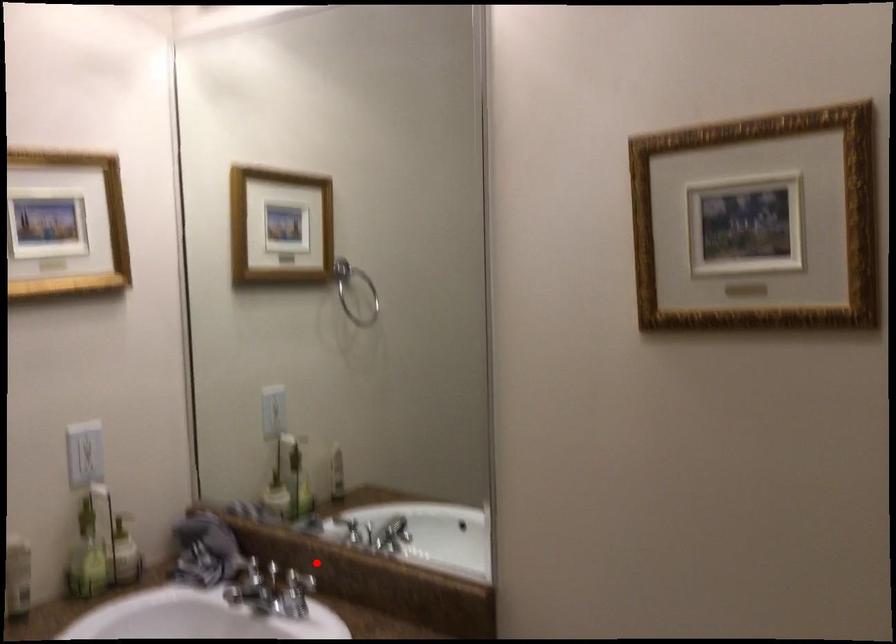
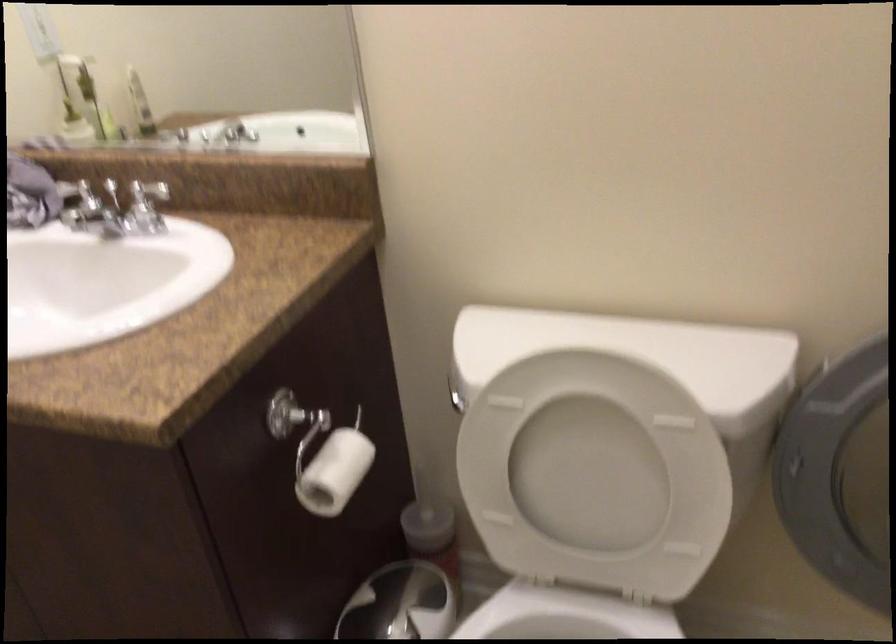
Question: I am providing you with two images of the same scene from different viewpoints. Given a red point in image1, look at the same physical point in image2. Is it:

Choices:
 (A) Closer to the viewpoint
 (B) Farther from the viewpoint

Answer: (A)